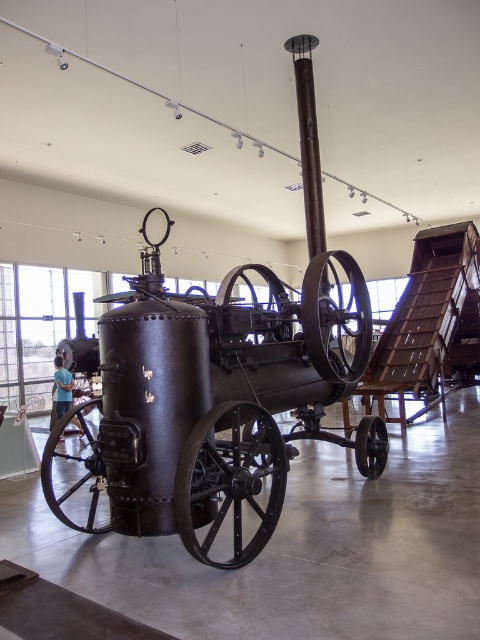
You are a museum visitor standing in front of the vintage steam engine. You notice the matte black steam engine at center and the blue shirt at lower left. Which object is closer to you, the visitor?

The matte black steam engine at center is closer to you than the blue shirt at lower left because it is positioned over it, indicating it is in front.

You are a museum guide explaining the layout of the exhibit. You see the matte black steam engine at center and the blue shirt at lower left. Which object is wider?

The matte black steam engine at center is wider than the blue shirt at lower left.

You are a museum visitor standing in front of the vintage steam engine display. You notice the matte black steam engine at center and the blue shirt at lower left. Which object is located to the right of the other?

The matte black steam engine at center is positioned on the right side of blue shirt at lower left, meaning it is to the right of the blue shirt at lower left.